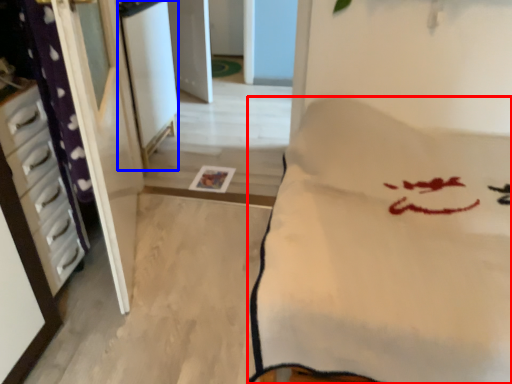
Question: Which object appears closest to the camera in this image, furniture (highlighted by a red box) or screen door (highlighted by a blue box)?

Choices:
 (A) furniture
 (B) screen door

Answer: (A)